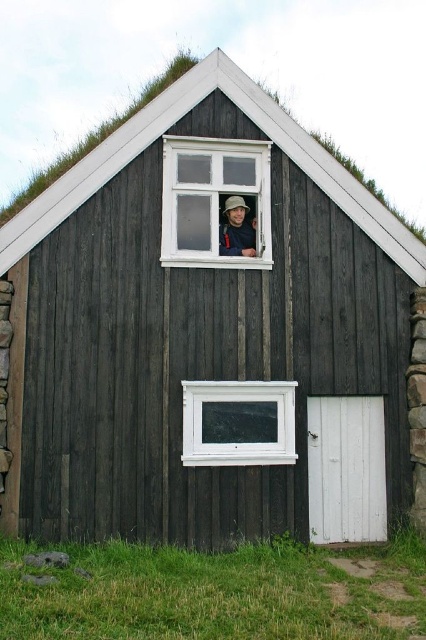
You are standing at the camera position and want to take a photo of the white wood window at upper center. The camera has a maximum focus range of 10 meters. Will the window be in focus?

The white wood window at upper center and camera are 9.90 meters apart from each other. Since the distance is within the camera maximum focus range of 10 meters, the window will be in focus.

In the scene shown: You are standing in front of the rustic wooden house and want to place a small potted plant between the white plastic window at lower center and the matte black hat at upper center. Which object should the plant be closer to?

The white plastic window at lower center is closer to the viewer than the matte black hat at upper center, so the plant should be placed closer to the matte black hat at upper center to maintain equal distance from both objects.

Looking at this image, you are standing in front of the rustic wooden house and notice two points marked on its exterior. The first point is at coordinates point (267, 240) and the second point is at point (238, 422). Which point is closer to you?

Point (267, 240) is further to the camera than point (238, 422), so the second point is closer to you.